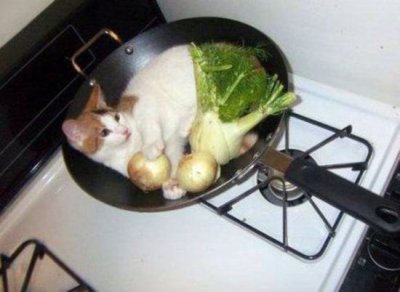
In order to click on black handle in this screenshot , I will do `click(353, 196)`.